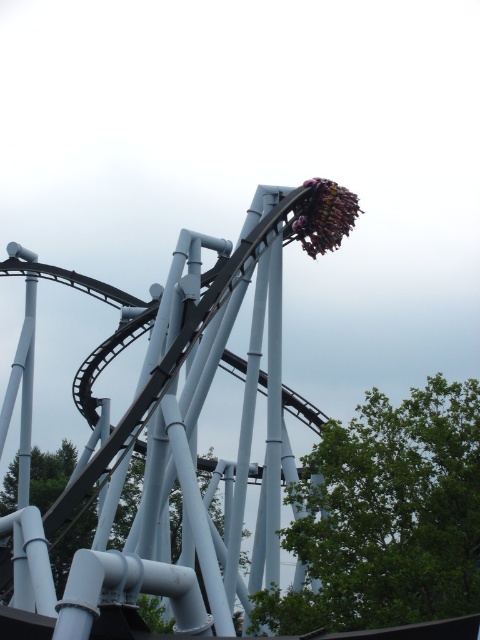
You are standing at the park entrance and see the metal roller coaster at upper center and the green matte tree at center. Which object is positioned more to the east if the park is oriented with north at the top?

The metal roller coaster at upper center is to the right of the green matte tree at center. Since the park is oriented with north at the top, right would correspond to east. Therefore, the metal roller coaster at upper center is positioned more to the east.

You are a photographer planning to take a photo of the roller coaster. You want to ensure both the green leafy tree at lower right and the green matte tree at center are visible in the frame. Which tree should you position closer to the edge of the photo to avoid overcrowding the composition?

You should position the green leafy tree at lower right closer to the edge of the photo because it is smaller in size compared to the green matte tree at center, which is larger and can occupy more space in the center without overcrowding the composition.

You are standing at the base of the green leafy tree at lower right and want to see the top of the metal roller coaster at upper center. Will the roller coaster be visible above the tree?

The metal roller coaster at upper center is taller than the green leafy tree at lower right, so yes, the roller coaster will be visible above the tree.